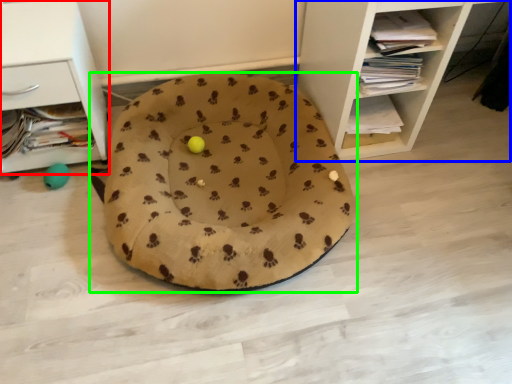
Question: Which object is the closest to the shelf (highlighted by a red box)? Choose among these: shelf (highlighted by a blue box) or dog bed (highlighted by a green box).

Choices:
 (A) shelf
 (B) dog bed

Answer: (B)